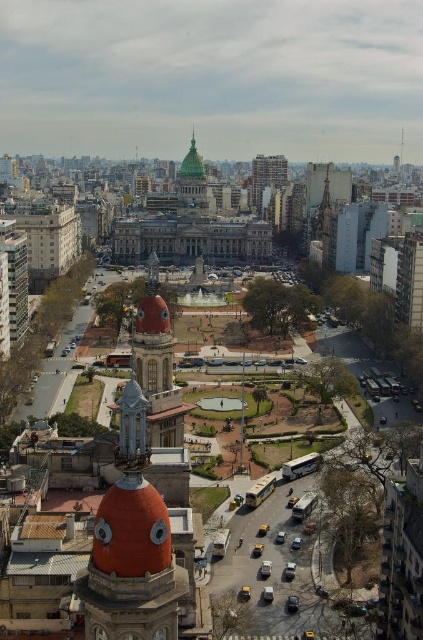
You are standing at the central government building in the plaza. You want to take a photo of a specific point located at coordinates point (178, 208). The camera you are using has a maximum focus range of 350 meters. Will the camera be able to focus on the point?

The distance of point (178, 208) from the camera is 365.32 meters, which exceeds the camera maximum focus range of 350 meters. Therefore, the camera will not be able to focus on the point.

You are standing in the plaza and want to take a photo of both the orange terracotta dome at center and the green glass dome at center. Which dome should you position closer to the camera to include both in the frame?

You should position the orange terracotta dome at center closer to the camera since it is already closer to the viewer than the green glass dome at center, allowing both to be captured in the frame.